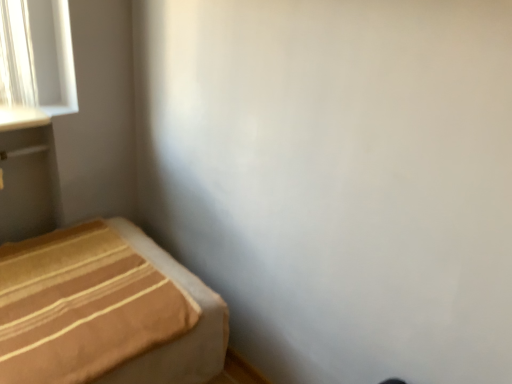
What is the approximate width of matte gray vanity at left?

5.58 inches.

Describe the element at coordinates (27, 174) in the screenshot. I see `matte gray vanity at left` at that location.

Find the location of a particular element. The width and height of the screenshot is (512, 384). matte gray vanity at left is located at coordinates (x=27, y=174).

Looking at this image, measure the distance between point (48,132) and camera.

The distance of point (48,132) from camera is 1.65 meters.

Where is `matte gray vanity at left`? This screenshot has width=512, height=384. matte gray vanity at left is located at coordinates (27, 174).